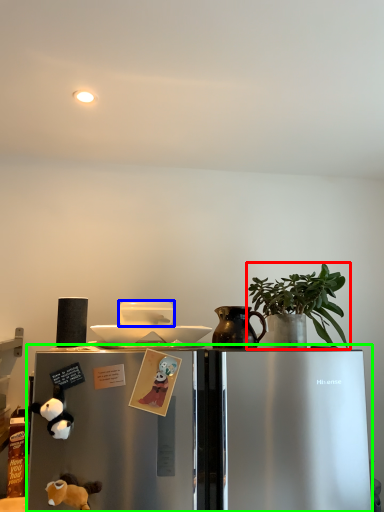
Question: Estimate the real-world distances between objects in this image. Which object is closer to houseplant (highlighted by a red box), appliance (highlighted by a blue box) or refrigerator (highlighted by a green box)?

Choices:
 (A) appliance
 (B) refrigerator

Answer: (B)